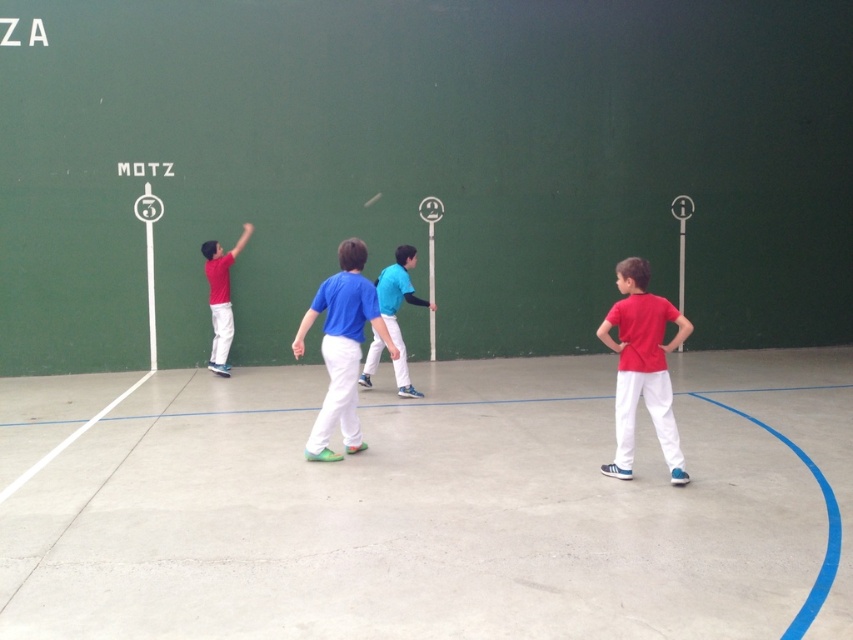
Question: Does matte red shirt at right appear under matte red shirt at left?

Choices:
 (A) yes
 (B) no

Answer: (A)

Question: Can you confirm if concrete floor at center is smaller than blue cotton shirt at center?

Choices:
 (A) yes
 (B) no

Answer: (B)

Question: Which point is closer to the camera taking this photo?

Choices:
 (A) (341, 332)
 (B) (653, 349)
 (C) (219, 323)

Answer: (B)

Question: Which point appears closest to the camera in this image?

Choices:
 (A) (403, 259)
 (B) (508, 531)
 (C) (299, 346)
 (D) (247, 234)

Answer: (B)

Question: Does blue cotton shirt at center have a larger size compared to blue jersey at center?

Choices:
 (A) no
 (B) yes

Answer: (A)

Question: Which of these objects is positioned closest to the blue cotton shirt at center?

Choices:
 (A) blue jersey at center
 (B) matte red shirt at right

Answer: (A)